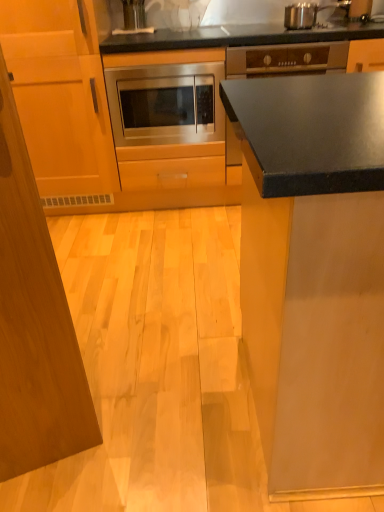
The image size is (384, 512). Describe the element at coordinates (143, 89) in the screenshot. I see `stainless steel microwave at center, the 1th cabinetry positioned from the right` at that location.

You are a GUI agent. You are given a task and a screenshot of the screen. Output one action in this format:
    pyautogui.click(x=<x>, y=<y>)
    Task: Click on the stainless steel microwave at center
    
    Given the screenshot: What is the action you would take?
    pyautogui.click(x=166, y=104)

Is stainless steel microwave at center, the 1th cabinetry positioned from the right, at the right side of matte black countertop at upper right?

Incorrect, stainless steel microwave at center, the 1th cabinetry positioned from the right, is not on the right side of matte black countertop at upper right.

Which object is wider, stainless steel microwave at center, the 1th cabinetry positioned from the right, or matte black countertop at upper right?

With larger width is stainless steel microwave at center, the 1th cabinetry positioned from the right.

Which point is more forward, (137,183) or (351,154)?

Point (351,154)

From the image's perspective, is stainless steel microwave at center, the 1th cabinetry positioned from the right, below matte black countertop at upper right?

Yes, from the image's perspective, stainless steel microwave at center, the 1th cabinetry positioned from the right, is beneath matte black countertop at upper right.

Which of these two, wooden cabinet at left, which is the 2th cabinetry from right to left, or stainless steel microwave at center, which is the 2th cabinetry from left to right, is wider?

wooden cabinet at left, which is the 2th cabinetry from right to left.

From a real-world perspective, which is physically below, wooden cabinet at left, which is counted as the 1th cabinetry, starting from the left, or stainless steel microwave at center, which is the 2th cabinetry from left to right?

stainless steel microwave at center, which is the 2th cabinetry from left to right, from a real-world perspective.

Is wooden cabinet at left, which is the 2th cabinetry from right to left, in front of or behind stainless steel microwave at center, which is the 2th cabinetry from left to right, in the image?

In the image, wooden cabinet at left, which is the 2th cabinetry from right to left, appears in front of stainless steel microwave at center, which is the 2th cabinetry from left to right.

Considering the points (70, 49) and (198, 204), which point is behind, point (70, 49) or point (198, 204)?

Positioned behind is point (198, 204).

In the scene shown: Are stainless steel microwave at center and matte black countertop at upper right located far from each other?

Indeed, stainless steel microwave at center is not near matte black countertop at upper right.

Does stainless steel microwave at center appear on the right side of matte black countertop at upper right?

No, stainless steel microwave at center is not to the right of matte black countertop at upper right.

How many degrees apart are the facing directions of stainless steel microwave at center and matte black countertop at upper right?

stainless steel microwave at center and matte black countertop at upper right are facing 0.753 degrees away from each other.

From a real-world perspective, is stainless steel microwave at center physically below matte black countertop at upper right?

Incorrect, from a real-world perspective, stainless steel microwave at center is higher than matte black countertop at upper right.

Does point (204, 57) come farther from viewer compared to point (211, 117)?

No.

Which of these two, stainless steel microwave at center, the 1th cabinetry positioned from the right, or stainless steel microwave at center, is wider?

Wider between the two is stainless steel microwave at center, the 1th cabinetry positioned from the right.

Locate an element on the screen. Image resolution: width=384 pixels, height=512 pixels. oven that is above the stainless steel microwave at center, which is the 2th cabinetry from left to right (from the image's perspective) is located at coordinates (166, 104).

Considering the sizes of objects wooden cabinet at left, which is the 2th cabinetry from right to left, and matte black countertop at upper right in the image provided, who is smaller, wooden cabinet at left, which is the 2th cabinetry from right to left, or matte black countertop at upper right?

Smaller between the two is matte black countertop at upper right.

Based on the photo, which object is thinner, wooden cabinet at left, which is counted as the 1th cabinetry, starting from the left, or matte black countertop at upper right?

Thinner between the two is matte black countertop at upper right.

Locate an element on the screen. This screenshot has height=512, width=384. countertop that appears above the wooden cabinet at left, which is counted as the 1th cabinetry, starting from the left (from the image's perspective) is located at coordinates (310, 132).

Can you confirm if matte black countertop at upper right is positioned to the right of wooden cabinet at left, which is counted as the 1th cabinetry, starting from the left?

Indeed, matte black countertop at upper right is positioned on the right side of wooden cabinet at left, which is counted as the 1th cabinetry, starting from the left.

Find the location of a particular element. countertop on the right of wooden cabinet at left, which is the 2th cabinetry from right to left is located at coordinates (310, 132).

From a real-world perspective, between matte black countertop at upper right and wooden cabinet at left, which is counted as the 1th cabinetry, starting from the left, who is vertically higher?

From a 3D spatial view, wooden cabinet at left, which is counted as the 1th cabinetry, starting from the left, is above.

In terms of height, does matte black countertop at upper right look taller or shorter compared to wooden cabinet at left, which is the 2th cabinetry from right to left?

Clearly, matte black countertop at upper right is shorter compared to wooden cabinet at left, which is the 2th cabinetry from right to left.

Based on the photo, considering their positions, is matte black countertop at upper right located in front of or behind stainless steel microwave at center?

Visually, matte black countertop at upper right is located in front of stainless steel microwave at center.

Where is `countertop in front of the stainless steel microwave at center`? Image resolution: width=384 pixels, height=512 pixels. countertop in front of the stainless steel microwave at center is located at coordinates (310, 132).

Between matte black countertop at upper right and stainless steel microwave at center, which one has smaller width?

stainless steel microwave at center is thinner.

From a real-world perspective, between matte black countertop at upper right and stainless steel microwave at center, who is vertically lower?

matte black countertop at upper right is physically lower.

Where is `countertop above the stainless steel microwave at center, which is the 2th cabinetry from left to right (from the image's perspective)`? countertop above the stainless steel microwave at center, which is the 2th cabinetry from left to right (from the image's perspective) is located at coordinates (310, 132).

Locate an element on the screen. The image size is (384, 512). cabinetry below the wooden cabinet at left, which is the 2th cabinetry from right to left (from a real-world perspective) is located at coordinates (143, 89).

Looking at the image, which one is located further to stainless steel microwave at center, stainless steel microwave at center, which is the 2th cabinetry from left to right, or matte black countertop at upper right?

matte black countertop at upper right lies further to stainless steel microwave at center than the other object.

Considering their positions, is stainless steel microwave at center positioned further to wooden cabinet at left, which is counted as the 1th cabinetry, starting from the left, than matte black countertop at upper right?

The object further to wooden cabinet at left, which is counted as the 1th cabinetry, starting from the left, is matte black countertop at upper right.

Looking at the image, which one is located closer to stainless steel microwave at center, matte black countertop at upper right or stainless steel microwave at center, which is the 2th cabinetry from left to right?

Among the two, stainless steel microwave at center, which is the 2th cabinetry from left to right, is located nearer to stainless steel microwave at center.

From the image, which object appears to be farther from wooden cabinet at left, which is the 2th cabinetry from right to left, stainless steel microwave at center or stainless steel microwave at center, which is the 2th cabinetry from left to right?

stainless steel microwave at center.

Estimate the real-world distances between objects in this image. Which object is closer to stainless steel microwave at center, wooden cabinet at left, which is the 2th cabinetry from right to left, or stainless steel microwave at center, the 1th cabinetry positioned from the right?

stainless steel microwave at center, the 1th cabinetry positioned from the right, lies closer to stainless steel microwave at center than the other object.

Looking at the image, which one is located closer to matte black countertop at upper right, wooden cabinet at left, which is the 2th cabinetry from right to left, or stainless steel microwave at center, the 1th cabinetry positioned from the right?

stainless steel microwave at center, the 1th cabinetry positioned from the right, lies closer to matte black countertop at upper right than the other object.

From the image, which object appears to be nearer to stainless steel microwave at center, which is the 2th cabinetry from left to right, matte black countertop at upper right or stainless steel microwave at center?

Among the two, stainless steel microwave at center is located nearer to stainless steel microwave at center, which is the 2th cabinetry from left to right.

Estimate the real-world distances between objects in this image. Which object is further from stainless steel microwave at center, matte black countertop at upper right or wooden cabinet at left, which is the 2th cabinetry from right to left?

matte black countertop at upper right lies further to stainless steel microwave at center than the other object.

Locate an element on the screen. This screenshot has width=384, height=512. cabinetry between stainless steel microwave at center and matte black countertop at upper right in the horizontal direction is located at coordinates (143, 89).

The width and height of the screenshot is (384, 512). What are the coordinates of `oven located between wooden cabinet at left, which is counted as the 1th cabinetry, starting from the left, and stainless steel microwave at center, the 1th cabinetry positioned from the right, in the left-right direction` in the screenshot? It's located at (166, 104).

Locate an element on the screen. The image size is (384, 512). oven between wooden cabinet at left, which is the 2th cabinetry from right to left, and matte black countertop at upper right, in the horizontal direction is located at coordinates (166, 104).

This screenshot has width=384, height=512. In order to click on cabinetry between wooden cabinet at left, which is the 2th cabinetry from right to left, and matte black countertop at upper right from left to right in this screenshot , I will do `click(143, 89)`.